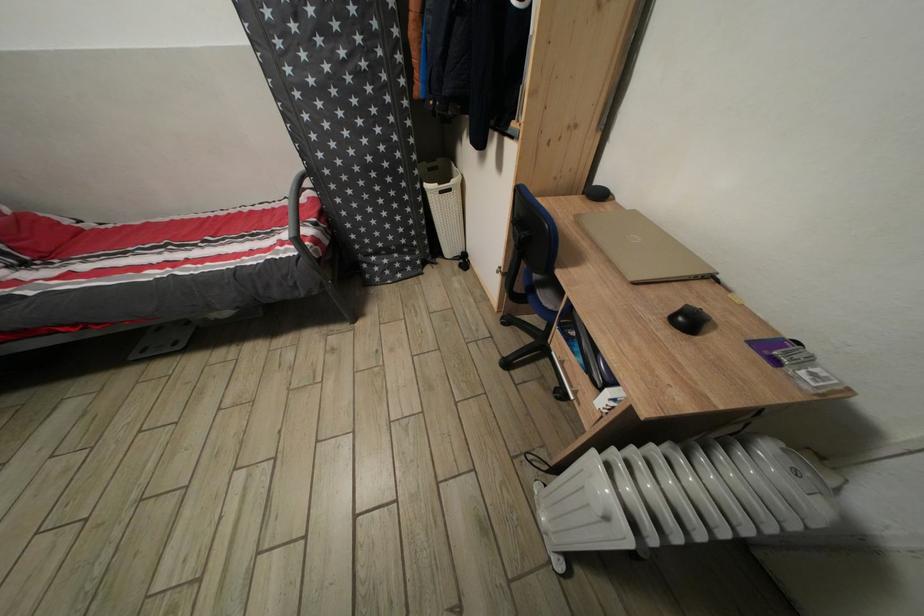
Image resolution: width=924 pixels, height=616 pixels. I want to click on white laundry basket, so click(444, 204).